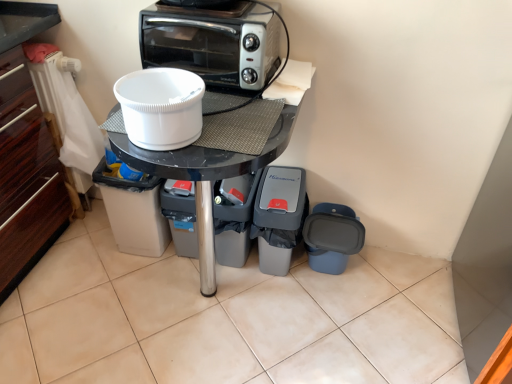
Identify the location of free space in front of gray plastic trash can at lower center, arranged as the second appliance when viewed from the right. (278, 299).